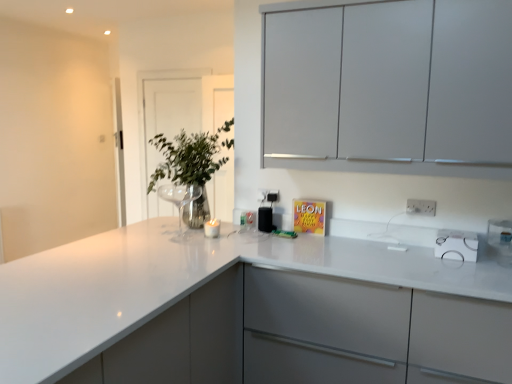
Based on the photo, what is the approximate height of metallic glass vase at center?

It is 9.14 inches.

Locate an element on the screen. Image resolution: width=512 pixels, height=384 pixels. metallic glass vase at center is located at coordinates pyautogui.click(x=180, y=202).

Where is `clear glass vase at upper left`? The image size is (512, 384). clear glass vase at upper left is located at coordinates (191, 167).

The image size is (512, 384). Describe the element at coordinates (421, 207) in the screenshot. I see `white plastic electric outlet at upper right, arranged as the 1th electric outlet when viewed from the right` at that location.

The image size is (512, 384). I want to click on black plastic speaker at center, so click(x=265, y=219).

Where is `transparent glass door at upper center`? transparent glass door at upper center is located at coordinates 169,112.

Image resolution: width=512 pixels, height=384 pixels. Describe the element at coordinates (169, 112) in the screenshot. I see `transparent glass door at upper center` at that location.

Where is `silver metallic electric outlet at center, which is the 1th electric outlet in left-to-right order`? The image size is (512, 384). silver metallic electric outlet at center, which is the 1th electric outlet in left-to-right order is located at coordinates (269, 195).

Is point (168, 180) behind point (420, 205)?

Yes, point (168, 180) is behind point (420, 205).

In the scene shown: Is transparent glass door at upper center thinner than white plastic electric outlet at upper right, arranged as the 1th electric outlet when viewed from the right?

Incorrect, the width of transparent glass door at upper center is not less than that of white plastic electric outlet at upper right, arranged as the 1th electric outlet when viewed from the right.

Choose the correct answer: Is transparent glass door at upper center inside white plastic electric outlet at upper right, which is the 2th electric outlet in back-to-front order, or outside it?

transparent glass door at upper center is not inside white plastic electric outlet at upper right, which is the 2th electric outlet in back-to-front order, it's outside.

Would you say transparent glass door at upper center is a long distance from white plastic electric outlet at upper right, arranged as the 1th electric outlet when viewed from the right?

Yes, transparent glass door at upper center and white plastic electric outlet at upper right, arranged as the 1th electric outlet when viewed from the right, are located far from each other.

In the scene shown: Which object is further away from the camera taking this photo, white plastic electric outlet at upper right, placed as the 1th electric outlet when sorted from front to back, or transparent glass door at upper center?

transparent glass door at upper center is further from the camera.

From a real-world perspective, relative to transparent glass door at upper center, is white plastic electric outlet at upper right, which is the 2th electric outlet in back-to-front order, vertically above or below?

white plastic electric outlet at upper right, which is the 2th electric outlet in back-to-front order, is below transparent glass door at upper center.

Which object is thinner, white plastic electric outlet at upper right, placed as the 1th electric outlet when sorted from front to back, or transparent glass door at upper center?

white plastic electric outlet at upper right, placed as the 1th electric outlet when sorted from front to back.

Consider the image. Is clear glass vase at upper left looking in the opposite direction of transparent glass door at upper center?

No, clear glass vase at upper left's orientation is not away from transparent glass door at upper center.

From the picture: How much distance is there between clear glass vase at upper left and transparent glass door at upper center?

The distance of clear glass vase at upper left from transparent glass door at upper center is 23.79 inches.

Identify the location of glass door that appears on the left of clear glass vase at upper left. Image resolution: width=512 pixels, height=384 pixels. (169, 112).

Would you say clear glass vase at upper left is to the left or to the right of transparent glass door at upper center in the picture?

clear glass vase at upper left is to the right of transparent glass door at upper center.

Between point (260, 230) and point (163, 103), which one is positioned behind?

Point (163, 103)

From the image's perspective, is black plastic speaker at center located beneath transparent glass door at upper center?

Yes, from the image's perspective, black plastic speaker at center is beneath transparent glass door at upper center.

From the picture: Is black plastic speaker at center in front of or behind transparent glass door at upper center in the image?

black plastic speaker at center is in front of transparent glass door at upper center.

Is black plastic speaker at center smaller than transparent glass door at upper center?

Yes.

Is white glossy countertop at center next to metallic glass vase at center and touching it?

No, white glossy countertop at center is not next to metallic glass vase at center.

Considering the sizes of objects white glossy countertop at center and metallic glass vase at center in the image provided, who is smaller, white glossy countertop at center or metallic glass vase at center?

metallic glass vase at center.

Looking at this image, which is in front, white glossy countertop at center or metallic glass vase at center?

white glossy countertop at center is more forward.

Is white glossy countertop at center taller than metallic glass vase at center?

Correct, white glossy countertop at center is much taller as metallic glass vase at center.

Between white glossy countertop at center and clear glass vase at upper left, which one has larger size?

white glossy countertop at center.

Is white glossy countertop at center not within clear glass vase at upper left?

Yes, white glossy countertop at center is located beyond the bounds of clear glass vase at upper left.

From a real-world perspective, is white glossy countertop at center above or below clear glass vase at upper left?

From a real-world perspective, white glossy countertop at center is physically below clear glass vase at upper left.

Between point (32, 255) and point (199, 140), which one is positioned behind?

Point (32, 255)

Does clear glass vase at upper left contain metallic glass vase at center?

That's correct, metallic glass vase at center is inside clear glass vase at upper left.

Is clear glass vase at upper left smaller than metallic glass vase at center?

Actually, clear glass vase at upper left might be larger than metallic glass vase at center.

Could you tell me if clear glass vase at upper left is facing metallic glass vase at center?

No.

From a real-world perspective, which object rests below the other?

In real-world perspective, metallic glass vase at center is lower.

I want to click on the 2nd electric outlet positioned below the transparent glass door at upper center (from the image's perspective), so click(421, 207).

Where is `glass door above the white plastic electric outlet at upper right, which is the 2th electric outlet in back-to-front order (from the image's perspective)`? The height and width of the screenshot is (384, 512). glass door above the white plastic electric outlet at upper right, which is the 2th electric outlet in back-to-front order (from the image's perspective) is located at coordinates (169, 112).

Considering their positions, is black plastic speaker at center positioned closer to metallic glass vase at center than white plastic electric outlet at upper right, placed as the 1th electric outlet when sorted from front to back?

black plastic speaker at center is closer to metallic glass vase at center.

Based on their spatial positions, is metallic glass vase at center or white glossy countertop at center closer to clear glass vase at upper left?

Based on the image, white glossy countertop at center appears to be nearer to clear glass vase at upper left.

Estimate the real-world distances between objects in this image. Which object is closer to black plastic speaker at center, metallic glass vase at center or white plastic electric outlet at upper right, which is the 2th electric outlet in back-to-front order?

white plastic electric outlet at upper right, which is the 2th electric outlet in back-to-front order.

Looking at the image, which one is located further to transparent glass door at upper center, black plastic speaker at center or white plastic electric outlet at upper right, arranged as the 1th electric outlet when viewed from the right?

white plastic electric outlet at upper right, arranged as the 1th electric outlet when viewed from the right, lies further to transparent glass door at upper center than the other object.

Looking at the image, which one is located closer to clear glass vase at upper left, black plastic speaker at center or white plastic electric outlet at upper right, which is the 2th electric outlet in back-to-front order?

black plastic speaker at center is positioned closer to the anchor clear glass vase at upper left.

Considering their positions, is transparent glass door at upper center positioned closer to clear glass vase at upper left than matte white cabinets at upper center?

The object closer to clear glass vase at upper left is transparent glass door at upper center.

Considering their positions, is white glossy countertop at center positioned closer to clear glass vase at upper left than metallic glass vase at center?

Based on the image, white glossy countertop at center appears to be nearer to clear glass vase at upper left.

Consider the image. When comparing their distances from white glossy countertop at center, does silver metallic electric outlet at center, acting as the 2th electric outlet starting from the front, or transparent glass door at upper center seem closer?

Based on the image, silver metallic electric outlet at center, acting as the 2th electric outlet starting from the front, appears to be nearer to white glossy countertop at center.

I want to click on appliance between white plastic electric outlet at upper right, positioned as the 2th electric outlet in left-to-right order, and transparent glass door at upper center in the front-back direction, so click(x=265, y=219).

Identify the location of vase between matte white cabinets at upper center and transparent glass door at upper center in the front-back direction. (180, 202).

This screenshot has height=384, width=512. Find the location of `appliance between clear glass vase at upper left and silver metallic electric outlet at center, marked as the second electric outlet in a right-to-left arrangement, in the horizontal direction`. appliance between clear glass vase at upper left and silver metallic electric outlet at center, marked as the second electric outlet in a right-to-left arrangement, in the horizontal direction is located at coordinates (265, 219).

Identify the location of vase between white glossy countertop at center and silver metallic electric outlet at center, positioned as the 1th electric outlet in back-to-front order, from front to back. This screenshot has width=512, height=384. click(180, 202).